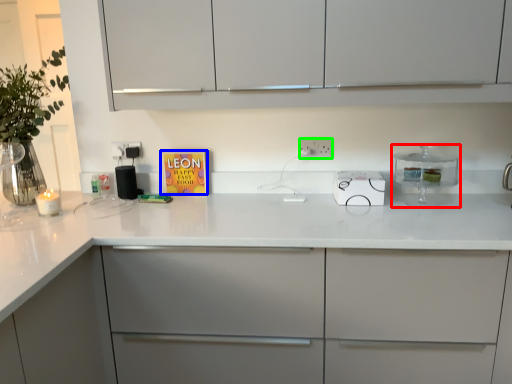
Question: Considering the real-world distances, which object is closest to kitchen appliance (highlighted by a red box)? book cover (highlighted by a blue box) or electric outlet (highlighted by a green box).

Choices:
 (A) book cover
 (B) electric outlet

Answer: (B)